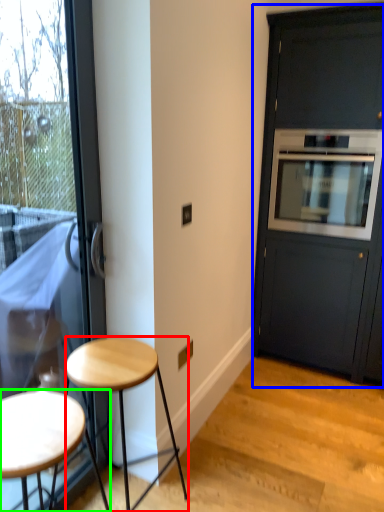
Question: Which is farther away from stool (highlighted by a red box)? cabinetry (highlighted by a blue box) or stool (highlighted by a green box)?

Choices:
 (A) cabinetry
 (B) stool

Answer: (A)